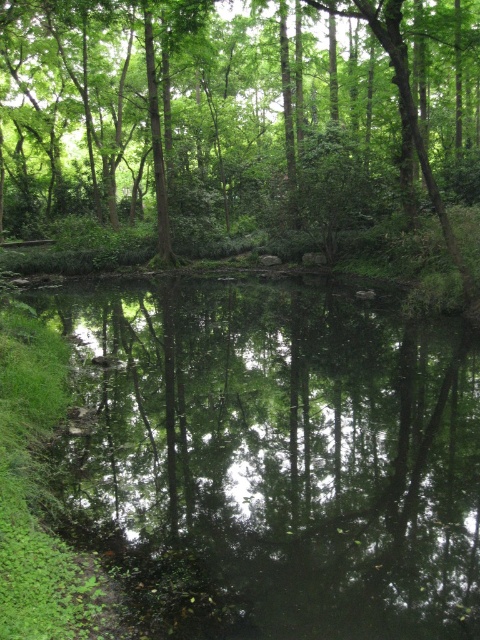
Who is taller, green reflective water at center or green leafy tree at center?

green leafy tree at center is taller.

Between green reflective water at center and green leafy tree at center, which one appears on the left side from the viewer's perspective?

From the viewer's perspective, green leafy tree at center appears more on the left side.

Who is more forward, [428,632] or [107,20]?

Point [428,632] is more forward.

The width and height of the screenshot is (480, 640). I want to click on green reflective water at center, so click(x=273, y=458).